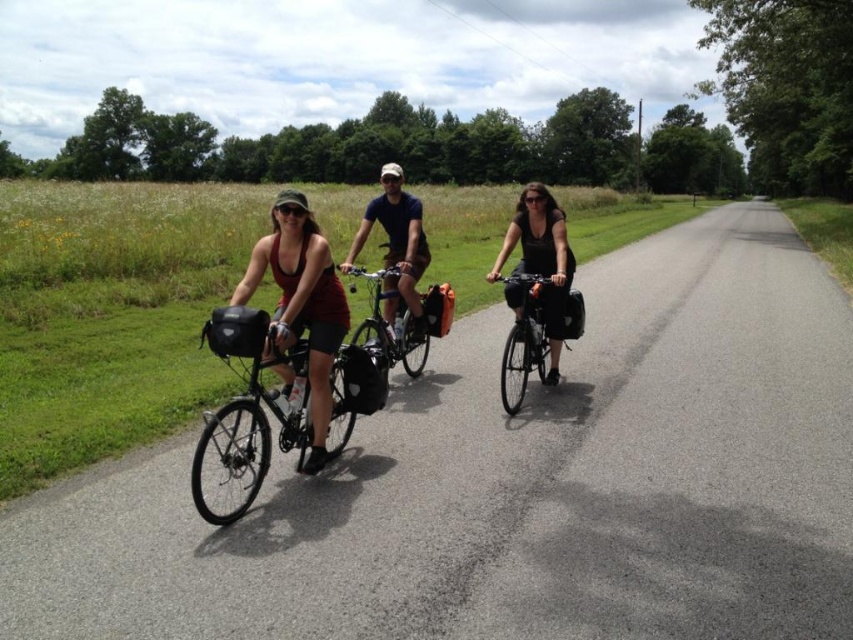
Question: In this image, where is shiny black bicycle at center-left located relative to matte blue shirt at center?

Choices:
 (A) right
 (B) left

Answer: (A)

Question: Based on their relative distances, which object is nearer to the shiny metallic bicycle at center?

Choices:
 (A) shiny black bicycle at center
 (B) matte blue shirt at center
 (C) shiny black bicycle at center-left

Answer: (B)

Question: Which is farther from the matte red tank top at center?

Choices:
 (A) shiny black bicycle at center
 (B) shiny black bicycle at center-left
 (C) shiny metallic bicycle at center
 (D) black matte dress at center

Answer: (D)

Question: In this image, where is matte red tank top at center located relative to matte blue shirt at center?

Choices:
 (A) below
 (B) above

Answer: (A)

Question: Considering the relative positions of shiny black bicycle at center-left and shiny metallic bicycle at center in the image provided, where is shiny black bicycle at center-left located with respect to shiny metallic bicycle at center?

Choices:
 (A) left
 (B) right

Answer: (A)

Question: Which of the following is the farthest from the observer?

Choices:
 (A) shiny black bicycle at center-left
 (B) matte blue shirt at center
 (C) black matte dress at center

Answer: (B)